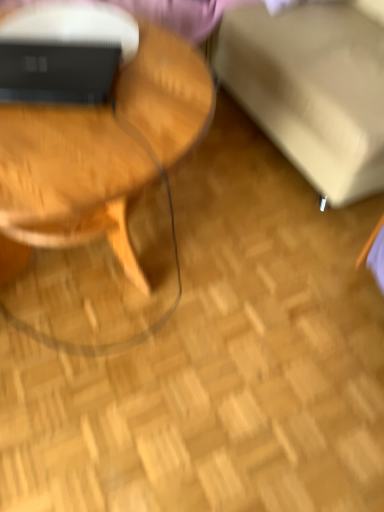
Question: Does woodenmaterial/texturecoffee table at left have a larger size compared to matte black laptop at upper left?

Choices:
 (A) yes
 (B) no

Answer: (A)

Question: From the image's perspective, is woodenmaterial/texturecoffee table at left on top of matte black laptop at upper left?

Choices:
 (A) no
 (B) yes

Answer: (A)

Question: Considering the relative sizes of woodenmaterial/texturecoffee table at left and matte black laptop at upper left in the image provided, is woodenmaterial/texturecoffee table at left smaller than matte black laptop at upper left?

Choices:
 (A) no
 (B) yes

Answer: (A)

Question: Considering the relative positions of woodenmaterial/texturecoffee table at left and matte black laptop at upper left in the image provided, is woodenmaterial/texturecoffee table at left behind matte black laptop at upper left?

Choices:
 (A) no
 (B) yes

Answer: (A)

Question: Is woodenmaterial/texturecoffee table at left aimed at matte black laptop at upper left?

Choices:
 (A) no
 (B) yes

Answer: (A)

Question: Considering their positions, is matte black laptop at upper left located in front of or behind beige fabric swivel chair at upper right?

Choices:
 (A) behind
 (B) front

Answer: (A)

Question: From the image's perspective, is matte black laptop at upper left located above or below beige fabric swivel chair at upper right?

Choices:
 (A) below
 (B) above

Answer: (A)

Question: Is matte black laptop at upper left wider or thinner than beige fabric swivel chair at upper right?

Choices:
 (A) wide
 (B) thin

Answer: (B)

Question: Is matte black laptop at upper left spatially inside beige fabric swivel chair at upper right, or outside of it?

Choices:
 (A) outside
 (B) inside

Answer: (A)

Question: Does point pyautogui.click(x=327, y=5) appear closer or farther from the camera than point pyautogui.click(x=54, y=56)?

Choices:
 (A) closer
 (B) farther

Answer: (B)

Question: Looking at their shapes, would you say beige fabric swivel chair at upper right is wider or thinner than matte black laptop at upper left?

Choices:
 (A) thin
 (B) wide

Answer: (B)

Question: Is beige fabric swivel chair at upper right to the left or to the right of matte black laptop at upper left in the image?

Choices:
 (A) left
 (B) right

Answer: (B)

Question: Do you think beige fabric swivel chair at upper right is within matte black laptop at upper left, or outside of it?

Choices:
 (A) outside
 (B) inside

Answer: (A)

Question: Is point (306, 34) closer or farther from the camera than point (1, 196)?

Choices:
 (A) closer
 (B) farther

Answer: (B)

Question: From the image's perspective, is beige fabric swivel chair at upper right positioned above or below woodenmaterial/texturecoffee table at left?

Choices:
 (A) below
 (B) above

Answer: (B)